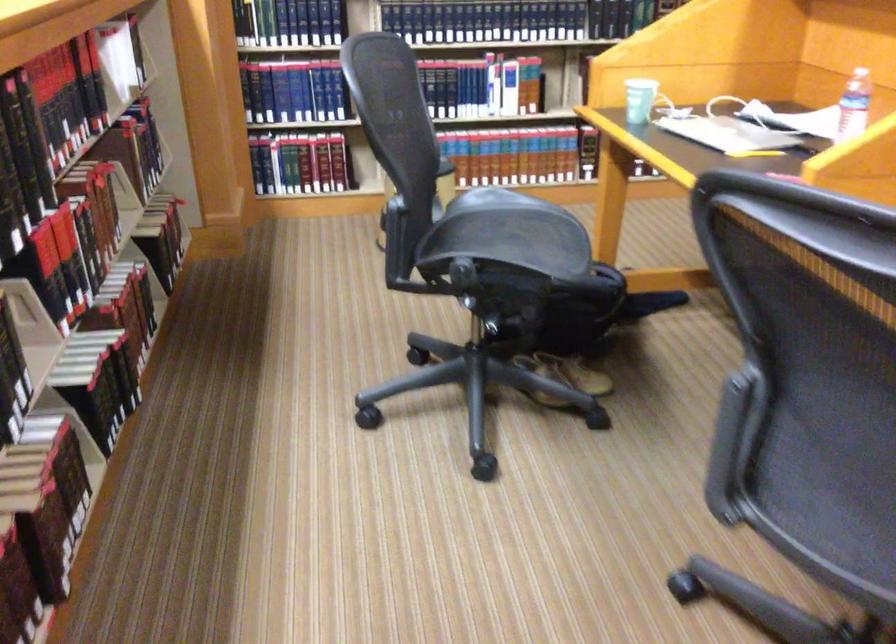
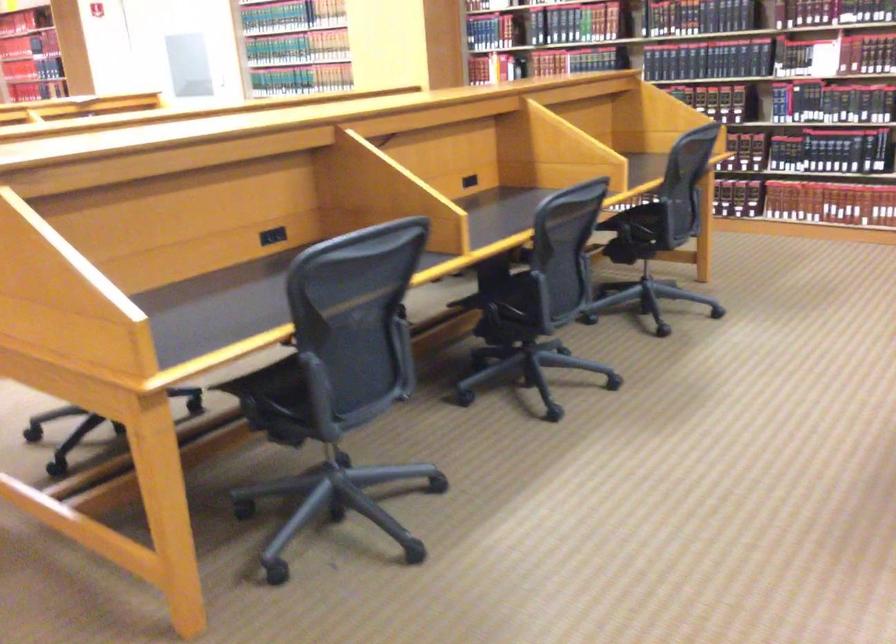
Question: I am providing you with two images of the same scene from different viewpoints. After the viewpoint changes to image2, which objects are now occluded?

Choices:
 (A) tan shoe
 (B) grey hard case handle
 (C) black power outlet
 (D) chair sitting surface

Answer: (A)